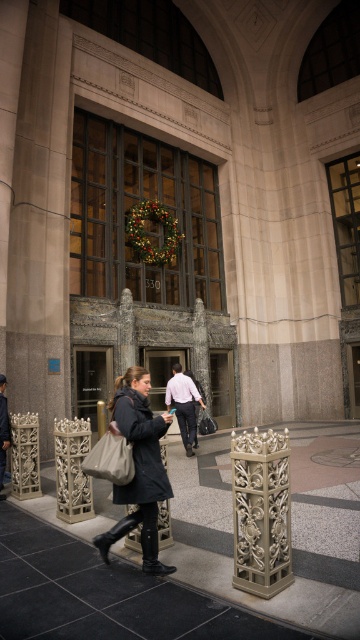
In the scene shown: Is carved stone column at center in front of light brown leather jacket at lower left?

Yes, carved stone column at center is in front of light brown leather jacket at lower left.

Is carved stone column at center smaller than light brown leather jacket at lower left?

No, carved stone column at center is not smaller than light brown leather jacket at lower left.

Does point (240, 524) come farther from viewer compared to point (2, 436)?

No, (240, 524) is closer to viewer.

Locate an element on the screen. carved stone column at center is located at coordinates (261, 512).

Who is positioned more to the left, dark gray wool coat at center or light brown leather jacket at lower left?

light brown leather jacket at lower left is more to the left.

Identify the location of dark gray wool coat at center. The height and width of the screenshot is (640, 360). (138, 467).

Who is shorter, dark gray wool coat at center or light brown leather jacket at center?

dark gray wool coat at center

Locate an element on the screen. The image size is (360, 640). dark gray wool coat at center is located at coordinates (138, 467).